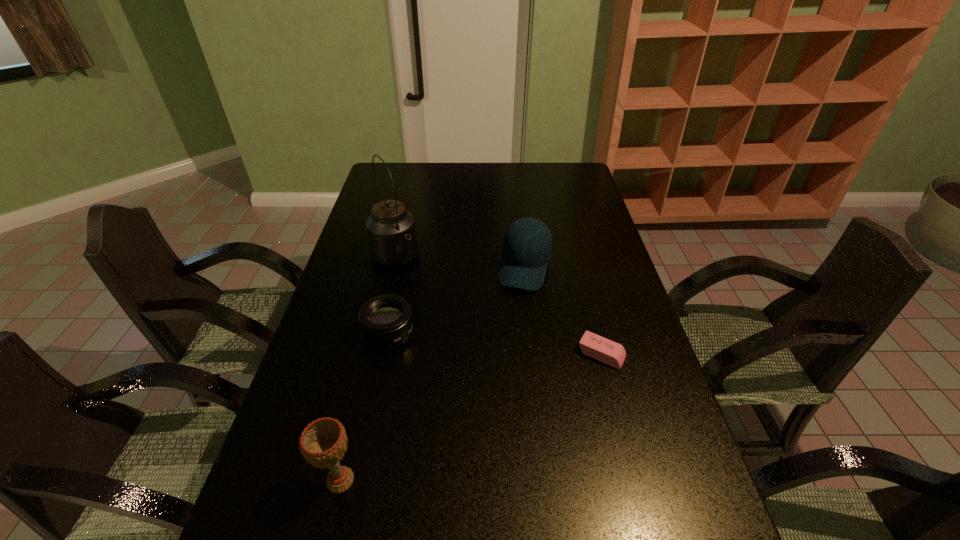
Where is `unoccupied position between the tallest object and the rightmost object`? unoccupied position between the tallest object and the rightmost object is located at coordinates (498, 307).

Where is `free point between the fourth shortest object and the kettle`? The width and height of the screenshot is (960, 540). free point between the fourth shortest object and the kettle is located at coordinates (368, 370).

At what (x,y) coordinates should I click in order to perform the action: click on free space between the eraser and the telephoto lens. Please return your answer as a coordinate pair (x, y). This screenshot has width=960, height=540. Looking at the image, I should click on (495, 344).

This screenshot has width=960, height=540. I want to click on vacant point located between the tallest object and the baseball cap, so click(460, 264).

Where is `free space between the tallest object and the nearest object`? The image size is (960, 540). free space between the tallest object and the nearest object is located at coordinates (368, 370).

The image size is (960, 540). Find the location of `free spot between the telephoto lens and the third shortest object`. free spot between the telephoto lens and the third shortest object is located at coordinates (457, 301).

You are a GUI agent. You are given a task and a screenshot of the screen. Output one action in this format:
    pyautogui.click(x=<x>, y=<y>)
    Task: Click on the empty space that is in between the third shortest object and the kettle
    
    Given the screenshot: What is the action you would take?
    pyautogui.click(x=460, y=264)

Find the location of a particular element. vacant area that lies between the kettle and the second object from right to left is located at coordinates (460, 264).

This screenshot has height=540, width=960. Identify the location of the closest object relative to the telephoto lens. (392, 238).

At what (x,y) coordinates should I click in order to perform the action: click on object that can be found as the second closest to the shortest object. Please return your answer as a coordinate pair (x, y). Looking at the image, I should click on (386, 322).